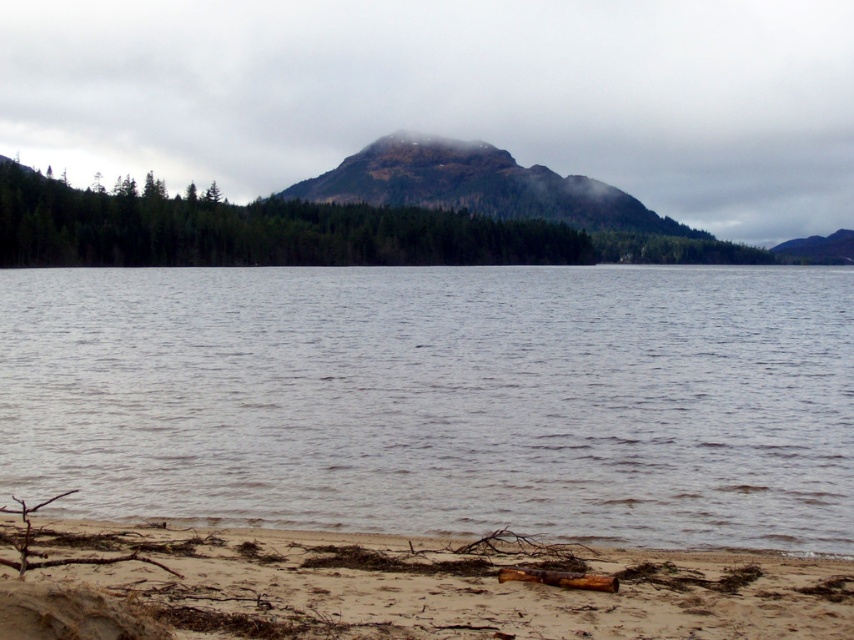
You are standing on the brown sandy beach at lower left and want to reach the rugged brown mountain at center. Based on the scene description, which direction should you head to move towards the mountain?

You should head towards the center direction from the brown sandy beach at lower left to reach the rugged brown mountain at center since the mountain is located at the center of the image relative to the beach at the lower left.

Based on the coordinates provided, what is the color and location of the object at point (440,397)?

The point (440,397) corresponds to gray water at center.